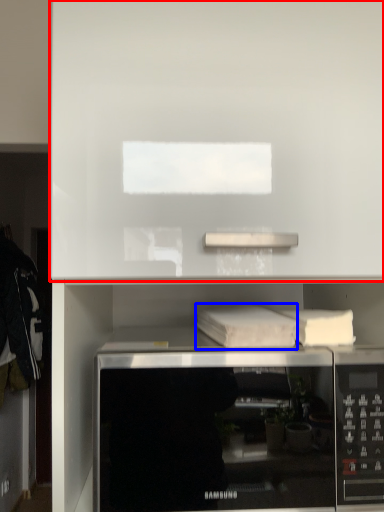
Question: Which object appears closest to the camera in this image, cabinet (highlighted by a red box) or book (highlighted by a blue box)?

Choices:
 (A) cabinet
 (B) book

Answer: (A)